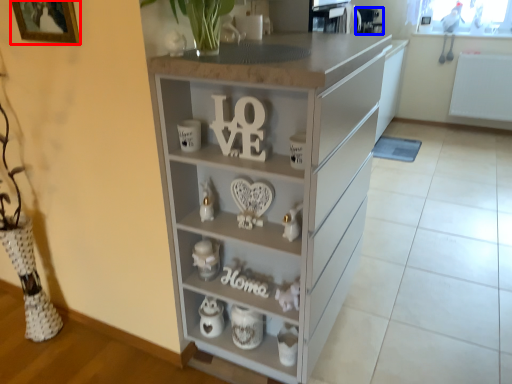
Question: Which object is further to the camera taking this photo, picture frame (highlighted by a red box) or appliance (highlighted by a blue box)?

Choices:
 (A) picture frame
 (B) appliance

Answer: (B)